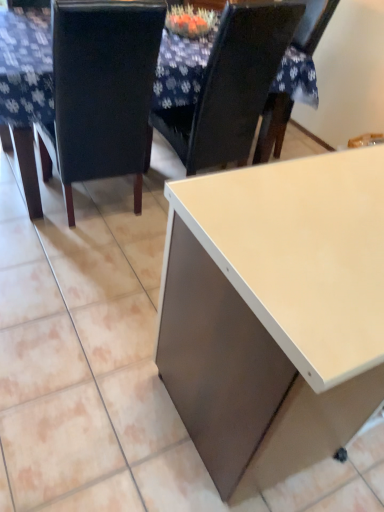
Where is `vacant space in front of black leather chair at left, the 1th chair in the left-to-right sequence`? Image resolution: width=384 pixels, height=512 pixels. vacant space in front of black leather chair at left, the 1th chair in the left-to-right sequence is located at coordinates (82, 271).